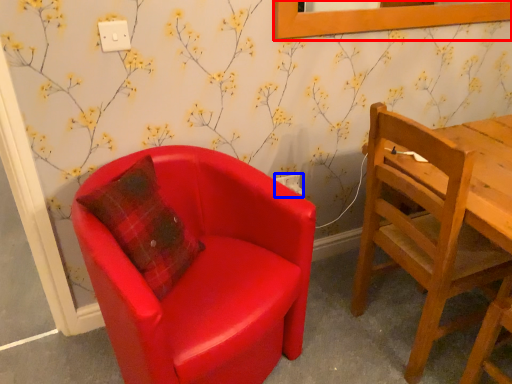
Question: Which point is closer to the camera, picture frame (highlighted by a red box) or power outlet (highlighted by a blue box)?

Choices:
 (A) picture frame
 (B) power outlet

Answer: (A)